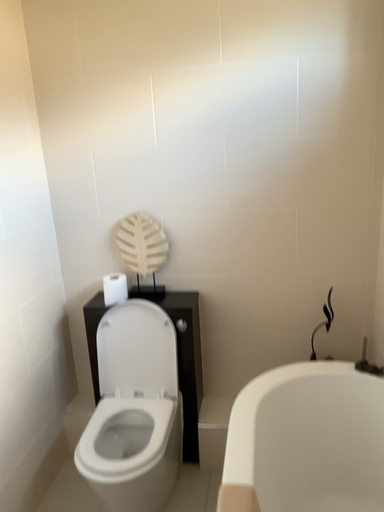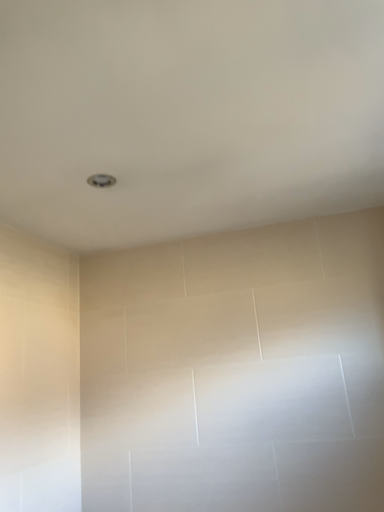
Question: Which way did the camera rotate in the video?

Choices:
 (A) rotated right
 (B) rotated left

Answer: (B)